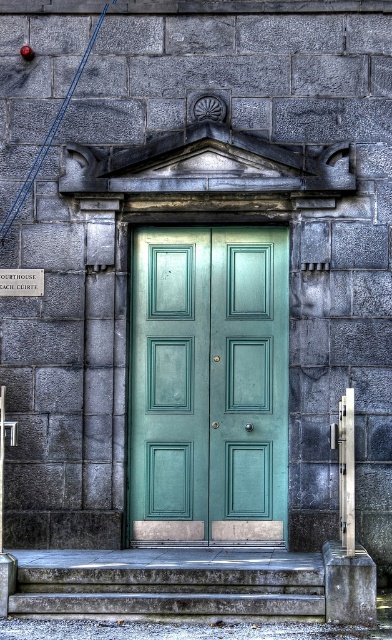
You are a delivery person carrying a large package that is 1.2 meters wide. You need to navigate through the teal glossy door at center and the smooth concrete stairs at center. Can you pass through the space between them with your package?

The teal glossy door at center and smooth concrete stairs at center are 1.02 meters apart from each other. Since your package is 1.2 meters wide, it is wider than the available space, so you cannot pass through the space between them with your package.

You are a painter who needs to decide whether to paint the teal glossy door at center or the smooth concrete stairs at center first. Since you want to start with the taller object, which one should you choose?

The teal glossy door at center has a greater height compared to the smooth concrete stairs at center, so you should paint the teal glossy door at center first.